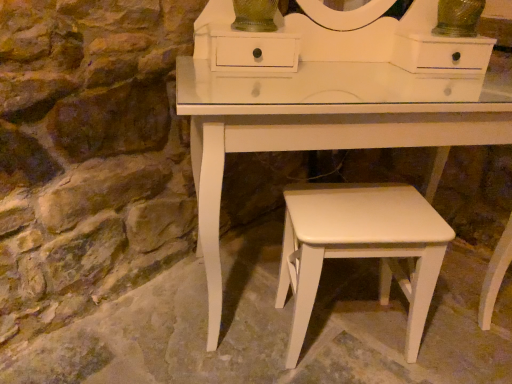
The image size is (512, 384). In order to click on vacant location below white matte stool at center (from a real-world perspective) in this screenshot , I will do `click(348, 337)`.